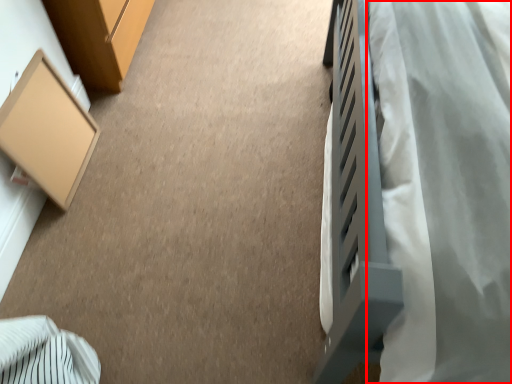
Question: From the image's perspective, where is blanket (annotated by the red box) located in relation to furniture in the image?

Choices:
 (A) above
 (B) below

Answer: (A)